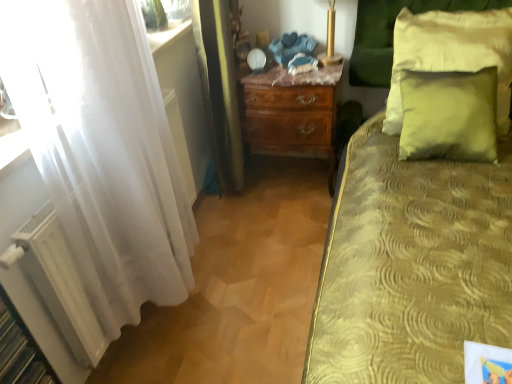
Question: Is green velvet pillow at upper right, which is counted as the second pillow, starting from the bottom, aimed at white sheer curtain at left?

Choices:
 (A) no
 (B) yes

Answer: (A)

Question: Can you confirm if green velvet pillow at upper right, which is counted as the second pillow, starting from the bottom, is smaller than white sheer curtain at left?

Choices:
 (A) yes
 (B) no

Answer: (A)

Question: Is green velvet pillow at upper right, the first pillow positioned from the top, next to white sheer curtain at left and touching it?

Choices:
 (A) no
 (B) yes

Answer: (A)

Question: From the image's perspective, is green velvet pillow at upper right, the first pillow positioned from the top, on white sheer curtain at left?

Choices:
 (A) no
 (B) yes

Answer: (B)

Question: Does green velvet pillow at upper right, the first pillow positioned from the top, lie behind white sheer curtain at left?

Choices:
 (A) yes
 (B) no

Answer: (A)

Question: Does point (13, 362) appear closer or farther from the camera than point (431, 92)?

Choices:
 (A) closer
 (B) farther

Answer: (A)

Question: Considering the positions of white matte radiator at lower left and green velvet pillow at upper right, which appears as the first pillow when ordered from the bottom, in the image, is white matte radiator at lower left bigger or smaller than green velvet pillow at upper right, which appears as the first pillow when ordered from the bottom,?

Choices:
 (A) small
 (B) big

Answer: (A)

Question: In the image, is white matte radiator at lower left positioned in front of or behind green velvet pillow at upper right, which appears as the first pillow when ordered from the bottom?

Choices:
 (A) behind
 (B) front

Answer: (B)

Question: Considering the positions of white matte radiator at lower left and green velvet pillow at upper right, the second pillow positioned from the top, in the image, is white matte radiator at lower left wider or thinner than green velvet pillow at upper right, the second pillow positioned from the top,?

Choices:
 (A) wide
 (B) thin

Answer: (A)

Question: In the image, is green velvet pillow at upper right, which appears as the first pillow when ordered from the bottom, positioned in front of or behind white sheer curtain at left?

Choices:
 (A) front
 (B) behind

Answer: (B)

Question: Is point (476, 97) closer or farther from the camera than point (158, 218)?

Choices:
 (A) closer
 (B) farther

Answer: (B)

Question: In terms of width, does green velvet pillow at upper right, which appears as the first pillow when ordered from the bottom, look wider or thinner when compared to white sheer curtain at left?

Choices:
 (A) wide
 (B) thin

Answer: (B)

Question: From a real-world perspective, is green velvet pillow at upper right, which appears as the first pillow when ordered from the bottom, physically located above or below white sheer curtain at left?

Choices:
 (A) above
 (B) below

Answer: (B)

Question: Does point (45, 359) appear closer or farther from the camera than point (330, 119)?

Choices:
 (A) closer
 (B) farther

Answer: (A)

Question: Is white matte radiator at lower left taller or shorter than mahogany wood nightstand at center?

Choices:
 (A) short
 (B) tall

Answer: (A)